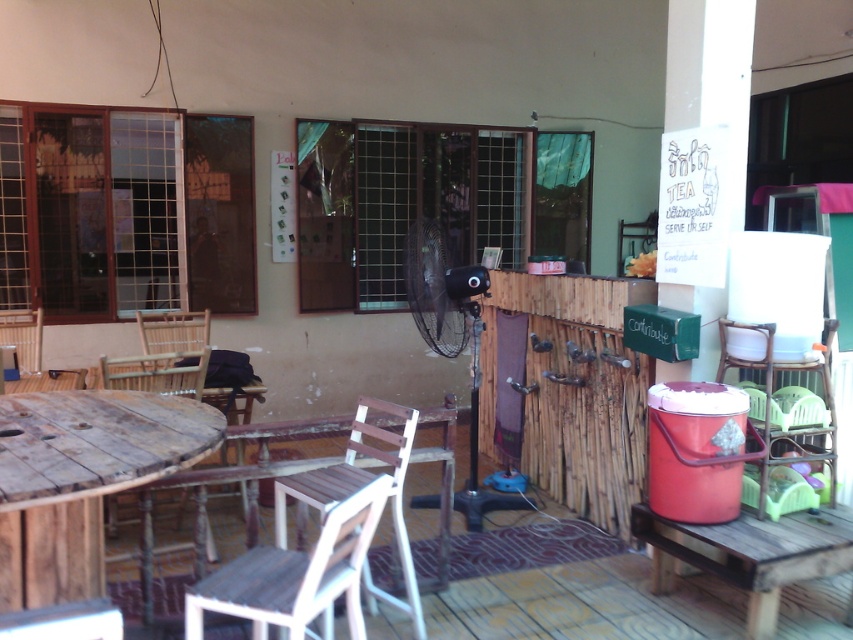
You are sitting at the rustic wood table at lower right and want to move to the wooden chair at lower left. Is the chair directly above the table?

Yes, the wooden chair at lower left is directly above the rustic wood table at lower right because the table is positioned under the chair.

You are a customer at the outdoor seating area and want to sit down. You see the weathered wood table at lower left and the wooden chair at left. Which object is closer to you?

The wooden chair at left is closer to you because the weathered wood table at lower left is positioned under it, meaning the chair is above the table from your perspective.